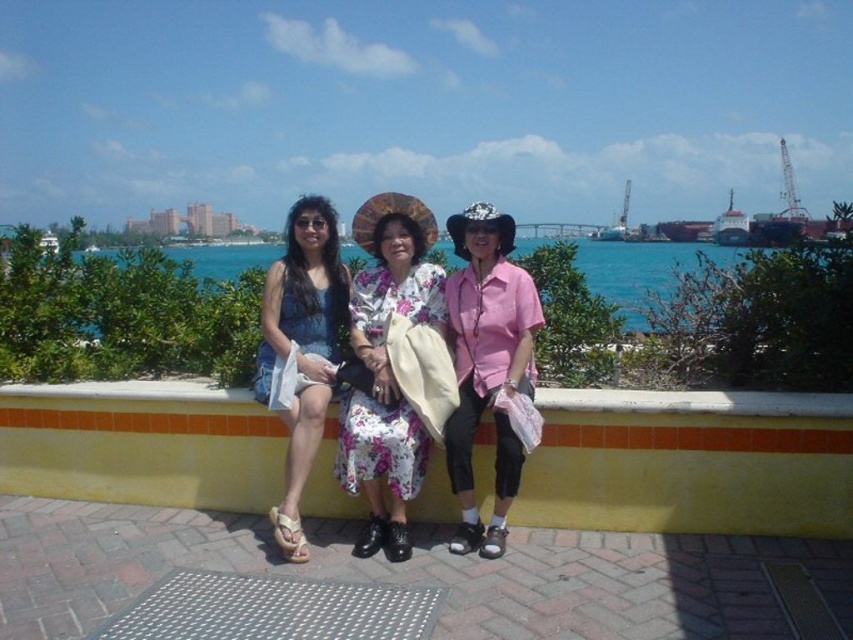
You are standing at the edge of the waterfront promenade looking towards the yellow wall with a red stripe. There is a person wearing a sleeveless blue dress on the left and a person wearing a floral fabric dress at center. Which of these two people is closer to you?

The floral fabric dress at center is closer to you because its position at point [387,369] indicates it is nearer in the scene compared to the sleeveless blue dress on the left.